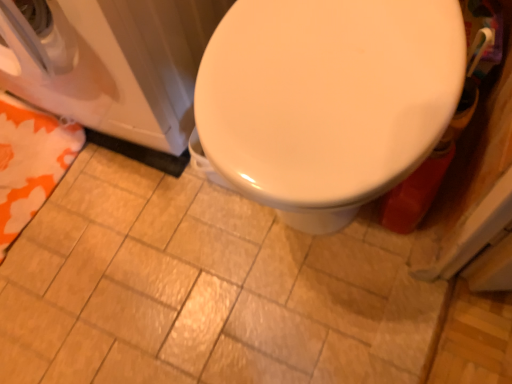
Question: Is orange fabric towel at lower left at the left side of white glossy washer at left?

Choices:
 (A) yes
 (B) no

Answer: (A)

Question: Considering the relative sizes of orange fabric towel at lower left and white glossy washer at left in the image provided, is orange fabric towel at lower left bigger than white glossy washer at left?

Choices:
 (A) yes
 (B) no

Answer: (B)

Question: From a real-world perspective, is orange fabric towel at lower left on top of white glossy washer at left?

Choices:
 (A) no
 (B) yes

Answer: (A)

Question: Is orange fabric towel at lower left not near white glossy washer at left?

Choices:
 (A) yes
 (B) no

Answer: (B)

Question: From the image's perspective, does orange fabric towel at lower left appear lower than white glossy washer at left?

Choices:
 (A) no
 (B) yes

Answer: (B)

Question: From a real-world perspective, does orange fabric towel at lower left sit lower than white glossy washer at left?

Choices:
 (A) yes
 (B) no

Answer: (A)

Question: Is matte ceramic tile at center in front of white glossy washer at left?

Choices:
 (A) yes
 (B) no

Answer: (B)

Question: Is matte ceramic tile at center behind white glossy washer at left?

Choices:
 (A) no
 (B) yes

Answer: (B)

Question: From a real-world perspective, is matte ceramic tile at center positioned over white glossy washer at left based on gravity?

Choices:
 (A) no
 (B) yes

Answer: (A)

Question: Is matte ceramic tile at center positioned with its back to white glossy washer at left?

Choices:
 (A) yes
 (B) no

Answer: (B)

Question: Does matte ceramic tile at center have a lesser width compared to white glossy washer at left?

Choices:
 (A) yes
 (B) no

Answer: (B)

Question: Can you confirm if matte ceramic tile at center is smaller than white glossy washer at left?

Choices:
 (A) yes
 (B) no

Answer: (A)

Question: Would you say orange fabric towel at lower left is part of white glossy washer at left's contents?

Choices:
 (A) no
 (B) yes

Answer: (A)